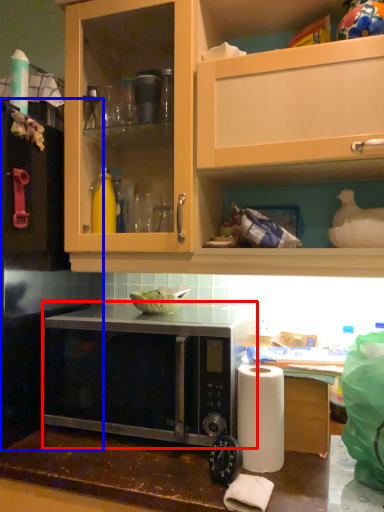
Question: Which object is further to the camera taking this photo, microwave oven (highlighted by a red box) or appliance (highlighted by a blue box)?

Choices:
 (A) microwave oven
 (B) appliance

Answer: (B)